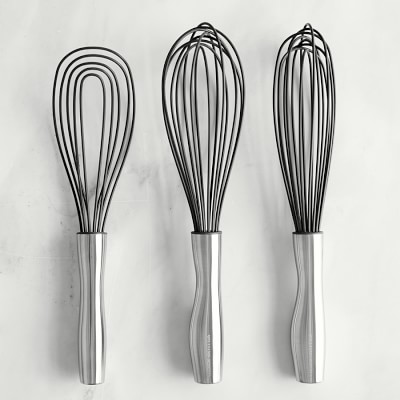
Find the location of `table`. table is located at coordinates (331, 276).